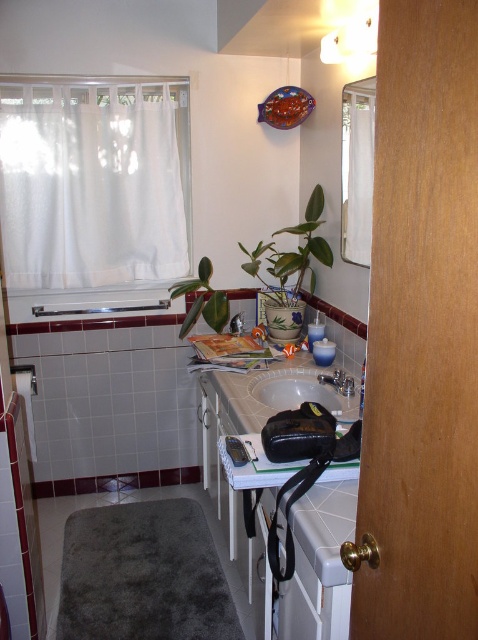
In the scene shown: Is green matte plant at upper center positioned before white glossy sink at center?

No, green matte plant at upper center is further to the viewer.

Between point (282, 257) and point (304, 378), which one is positioned behind?

The point (282, 257) is behind.

Who is more distant from viewer, (307, 220) or (324, 396)?

The point (307, 220) is behind.

I want to click on green matte plant at upper center, so click(x=292, y=253).

This screenshot has width=478, height=640. What do you see at coordinates (94, 182) in the screenshot?
I see `white sheer curtain at upper left` at bounding box center [94, 182].

Consider the image. Which is below, white sheer curtain at upper left or green matte plant at upper center?

green matte plant at upper center is lower down.

The height and width of the screenshot is (640, 478). Identify the location of white sheer curtain at upper left. (94, 182).

At what (x,y) coordinates should I click in order to perform the action: click on white sheer curtain at upper left. Please return your answer as a coordinate pair (x, y). The width and height of the screenshot is (478, 640). Looking at the image, I should click on (94, 182).

Which is above, white glossy vanity at center or white glossy sink at center?

Positioned higher is white glossy sink at center.

Does point (307, 525) come behind point (263, 380)?

No.

Identify the location of white glossy vanity at center. The height and width of the screenshot is (640, 478). (260, 428).